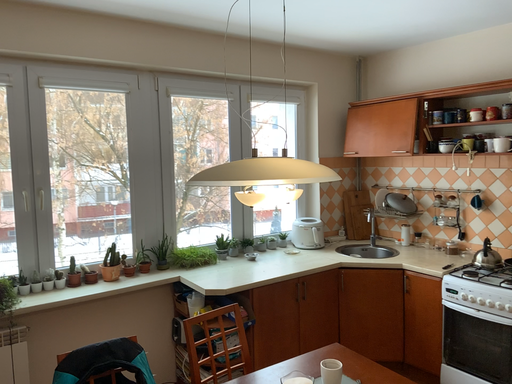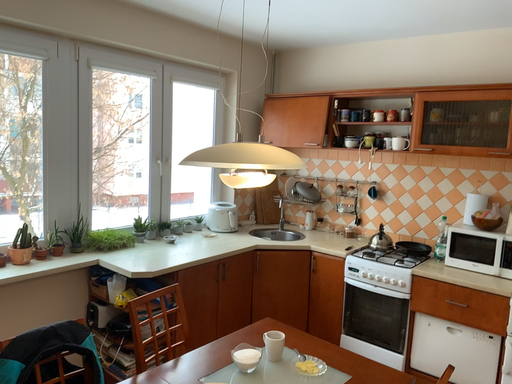
Question: Which way did the camera rotate in the video?

Choices:
 (A) rotated left
 (B) rotated right

Answer: (B)